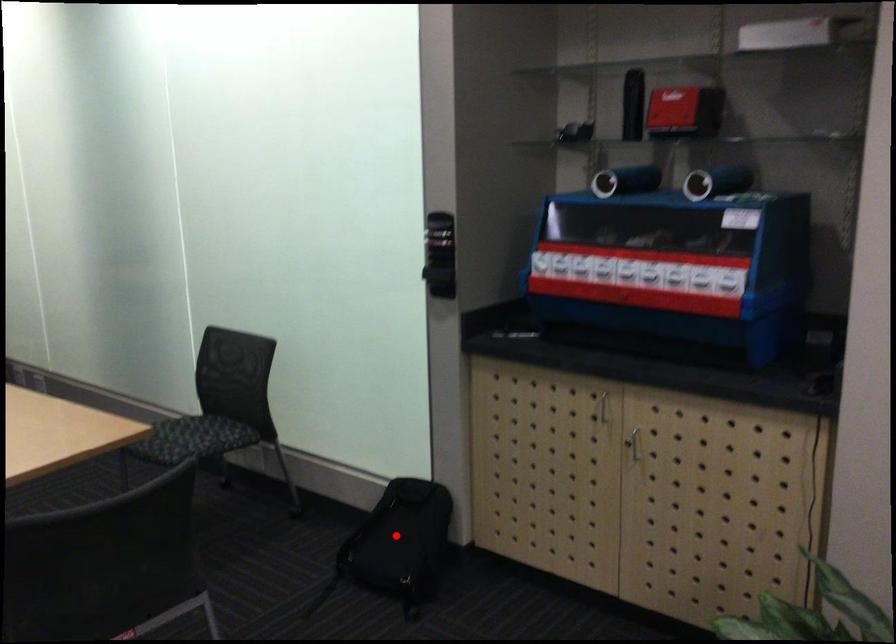
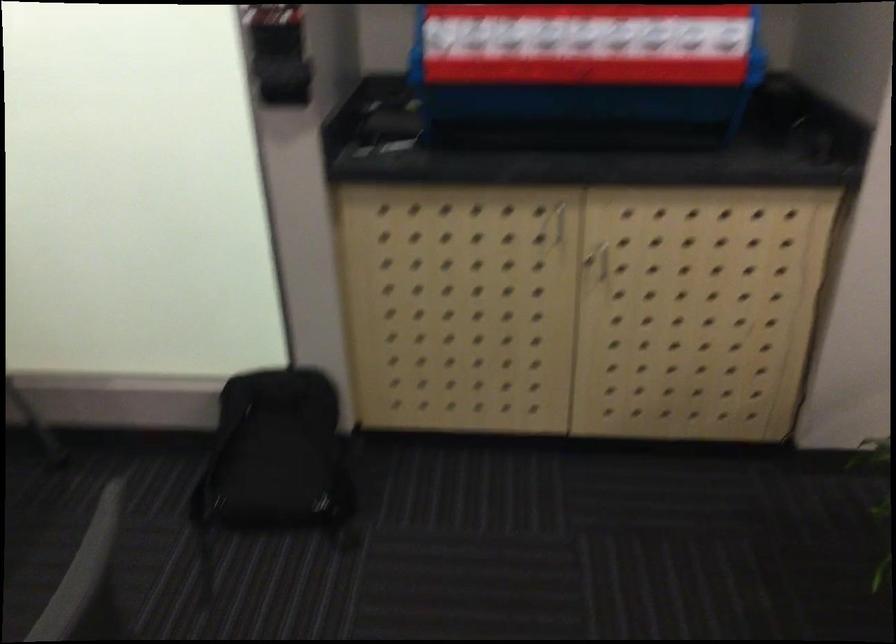
Question: I am providing you with two images of the same scene from different viewpoints. In image1, a red point is highlighted. Considering the same 3D point in image2, which of the following is correct?

Choices:
 (A) It is closer
 (B) It is farther

Answer: (A)